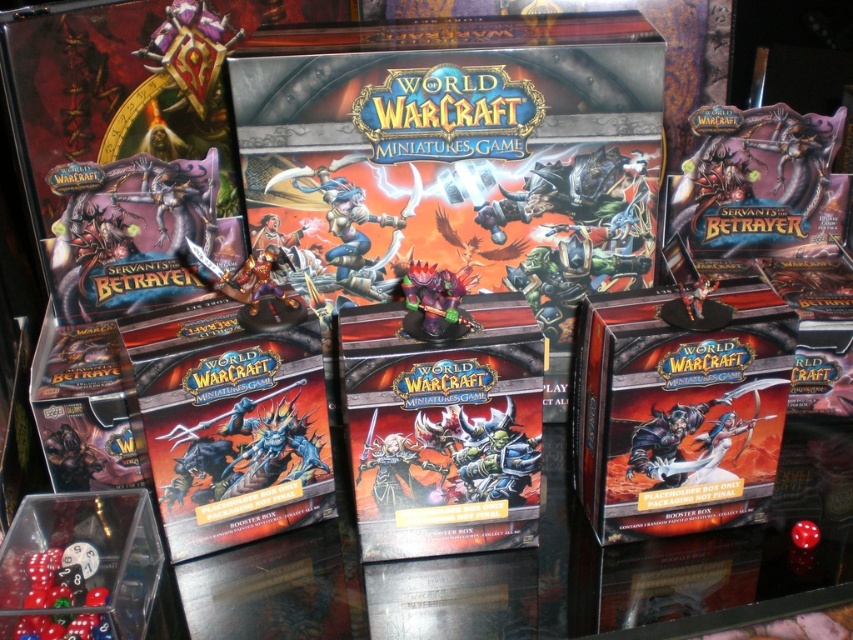
You are organizing a tabletop game night and need to place the translucent plastic dice at lower left and the satin purple figurine at center on a shelf. Which object should you place first if you want to arrange them from left to right in the correct order shown in the image?

You should place the translucent plastic dice at lower left first because in the image, the translucent plastic dice at lower left are positioned to the left of the satin purple figurine at center, so arranging them from left to right would start with the dice.

You are a collector who wants to place a new miniature on the table. You see the translucent plastic dice at lower left and the satin purple figurine at center. Which object is closer to you so you can move it out of the way first?

The translucent plastic dice at lower left is closer to the viewer than the satin purple figurine at center, so you can move it out of the way first.

You have a small box that is 3 inches wide. You need to place it on the table where the translucent plastic dice at lower left and the satin purple figurine at center are located. Which object should you place the box next to to ensure it fits without overlapping?

The translucent plastic dice at lower left might be wider than the satin purple figurine at center, so placing the box next to the satin purple figurine at center would be safer to avoid overlapping.